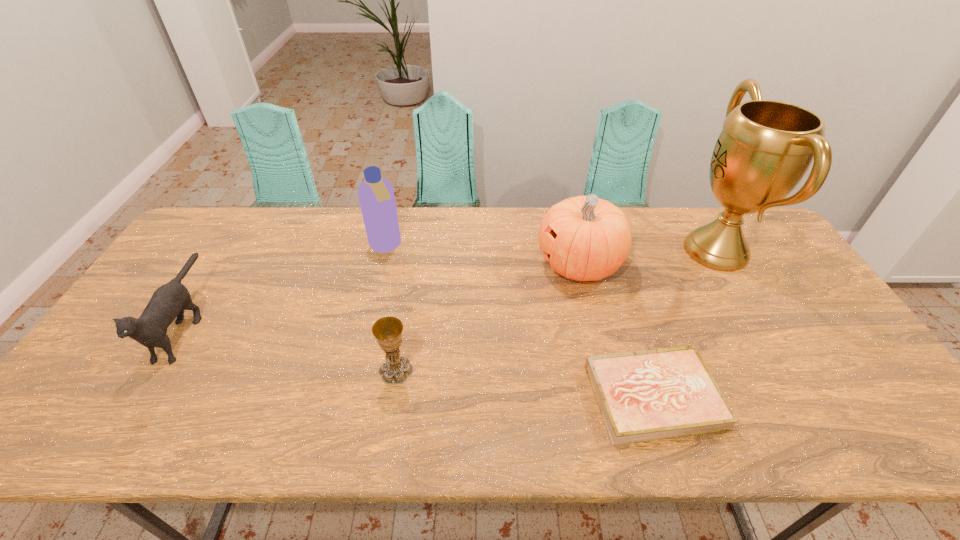
Where is `object located at the near edge`? Image resolution: width=960 pixels, height=540 pixels. object located at the near edge is located at coordinates click(647, 395).

You are a GUI agent. You are given a task and a screenshot of the screen. Output one action in this format:
    pyautogui.click(x=<x>, y=<y>)
    Task: Click on the object located in the left edge section of the desktop
    The height and width of the screenshot is (540, 960).
    Given the screenshot: What is the action you would take?
    pyautogui.click(x=169, y=301)

You are a GUI agent. You are given a task and a screenshot of the screen. Output one action in this format:
    pyautogui.click(x=<x>, y=<y>)
    Task: Click on the object that is at the right edge
    This screenshot has height=540, width=960.
    Given the screenshot: What is the action you would take?
    pyautogui.click(x=765, y=148)

Locate an element on the screen. This screenshot has height=540, width=960. object that is at the far right corner is located at coordinates (765, 148).

The height and width of the screenshot is (540, 960). Identify the location of vacant point at the far edge. (635, 247).

Where is `vacant area at the near edge of the desktop`? The image size is (960, 540). vacant area at the near edge of the desktop is located at coordinates (540, 430).

Where is `free region at the left edge of the desktop`? The image size is (960, 540). free region at the left edge of the desktop is located at coordinates (114, 378).

In the image, there is a desktop. Where is `vacant space at the right edge`? The height and width of the screenshot is (540, 960). vacant space at the right edge is located at coordinates (809, 376).

Image resolution: width=960 pixels, height=540 pixels. In order to click on vacant space at the far left corner of the desktop in this screenshot , I will do `click(233, 229)`.

At what (x,y) coordinates should I click in order to perform the action: click on free space between the shortest object and the pumpkin. Please return your answer as a coordinate pair (x, y). This screenshot has width=960, height=540. Looking at the image, I should click on (616, 330).